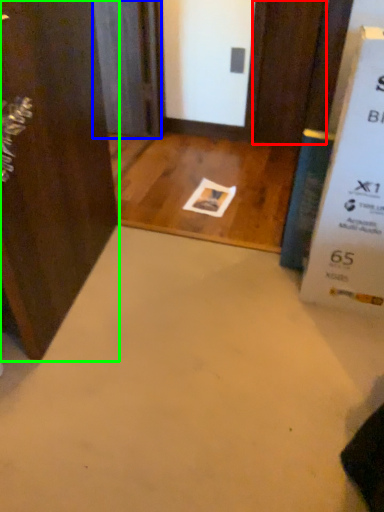
Question: Which object is positioned farthest from door (highlighted by a red box)? Select from screen door (highlighted by a blue box) and door (highlighted by a green box).

Choices:
 (A) screen door
 (B) door

Answer: (B)